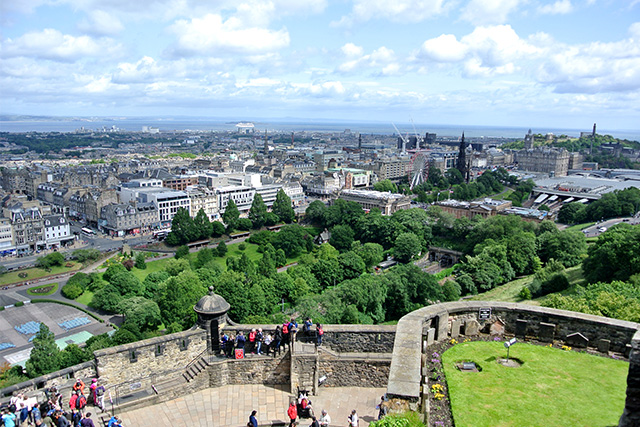
Locate an element on the screen. The height and width of the screenshot is (427, 640). door is located at coordinates (216, 341).